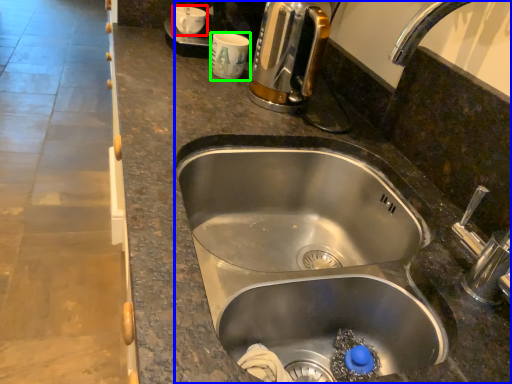
Question: Which is farther away from coffee cup (highlighted by a red box)? sink (highlighted by a blue box) or coffee cup (highlighted by a green box)?

Choices:
 (A) sink
 (B) coffee cup

Answer: (A)